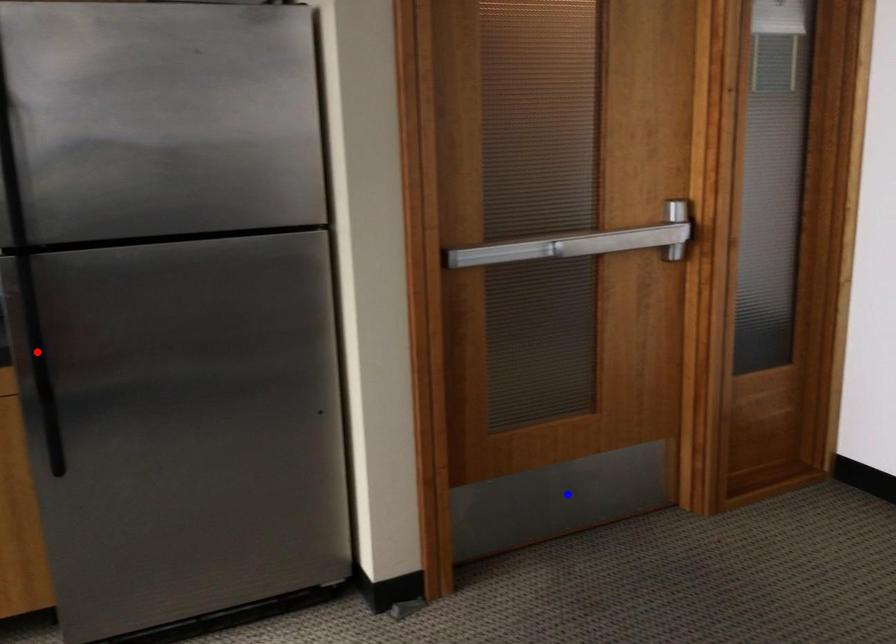
Question: In the image, two points are highlighted. Which point is nearer to the camera? Reply with the corresponding letter.

Choices:
 (A) blue point
 (B) red point

Answer: (B)